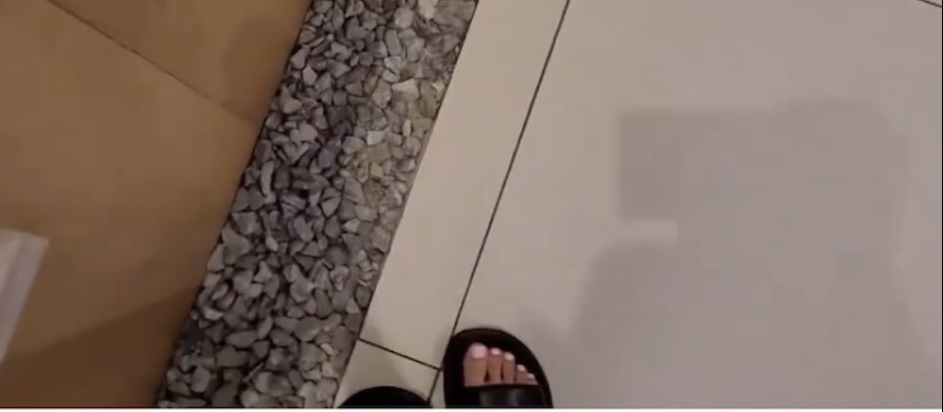
Image resolution: width=943 pixels, height=412 pixels. I want to click on floor, so click(668, 50).